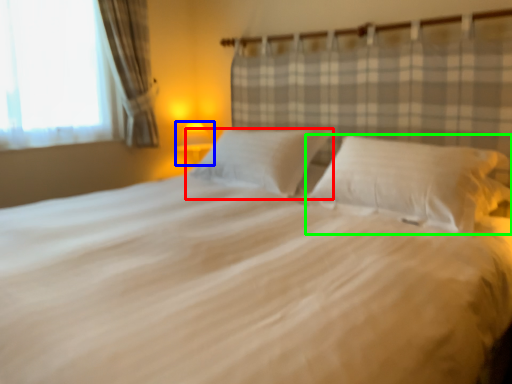
Question: Based on their relative distances, which object is farther from pillow (highlighted by a red box)? Choose from lamp (highlighted by a blue box) and pillow (highlighted by a green box).

Choices:
 (A) lamp
 (B) pillow

Answer: (A)